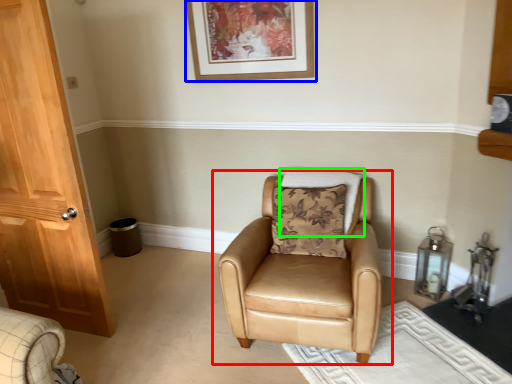
Question: Which object is positioned farthest from chair (highlighted by a red box)? Select from picture frame (highlighted by a blue box) and pillow (highlighted by a green box).

Choices:
 (A) picture frame
 (B) pillow

Answer: (A)